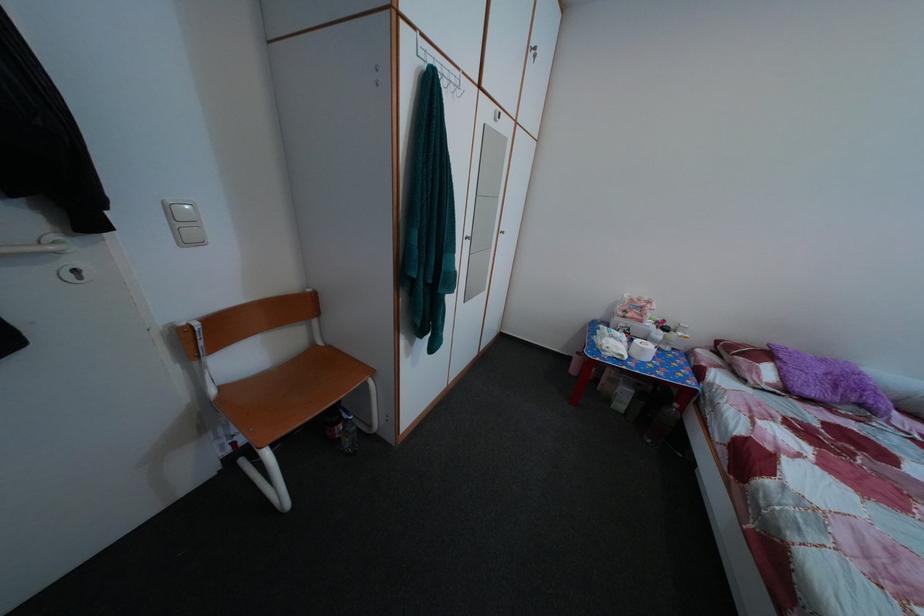
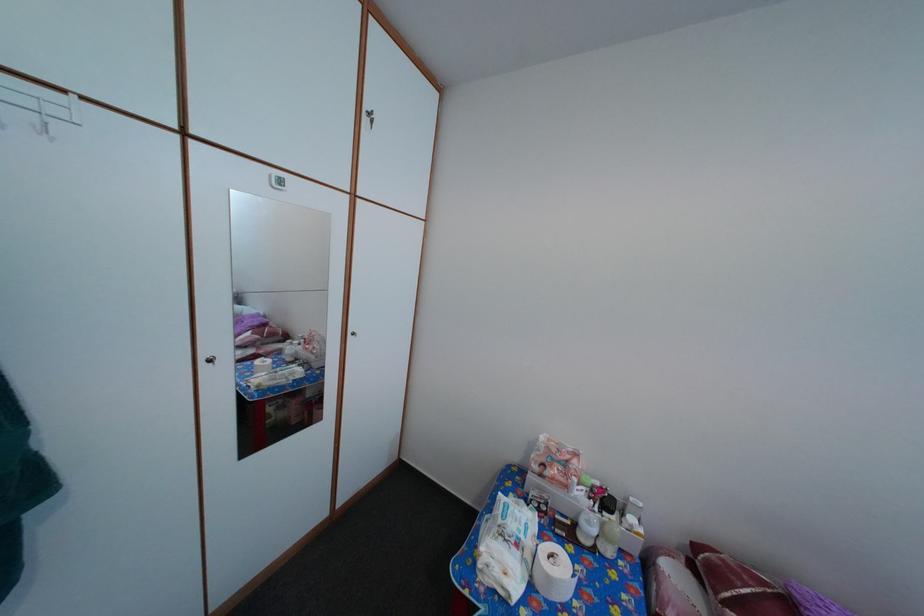
The point at (x=663, y=342) is marked in the first image. Where is the corresponding point in the second image?

(592, 531)